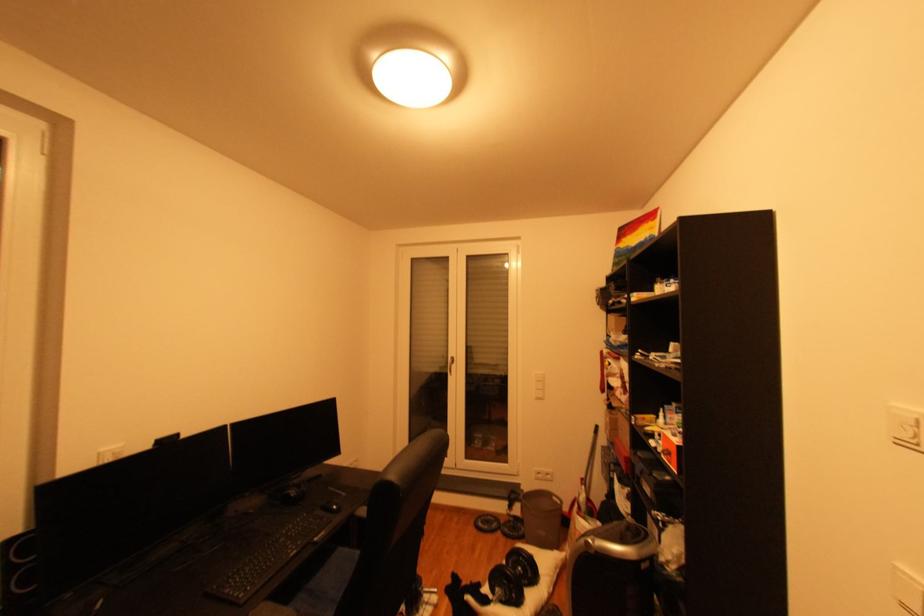
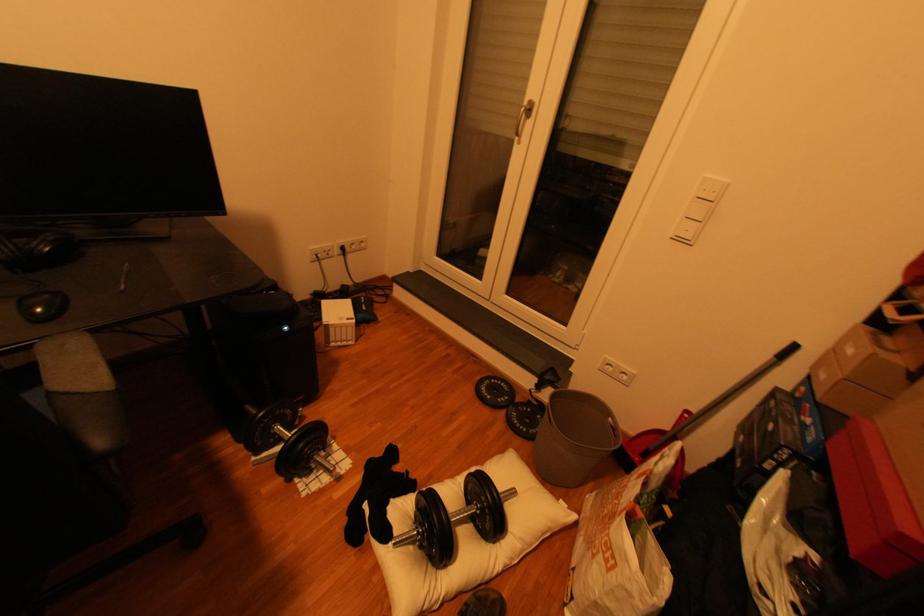
Find the pixel in the second image that matches point (492, 524) in the first image.

(497, 389)